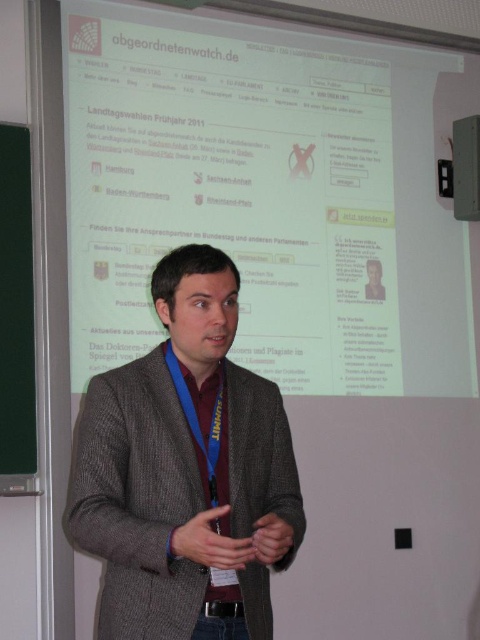
Which is more to the right, white glossy projection screen at upper center or gray woolen sweater at center?

Positioned to the right is white glossy projection screen at upper center.

Between white glossy projection screen at upper center and gray woolen sweater at center, which one has more height?

white glossy projection screen at upper center

Who is more forward, (319,310) or (184,476)?

Point (184,476) is more forward.

Identify the location of white glossy projection screen at upper center. The width and height of the screenshot is (480, 640). (x=264, y=196).

Does white glossy projection screen at upper center have a greater height compared to green matte/blackboard at left?

Indeed, white glossy projection screen at upper center has a greater height compared to green matte/blackboard at left.

Is the position of white glossy projection screen at upper center less distant than that of green matte/blackboard at left?

No.

In order to click on white glossy projection screen at upper center in this screenshot , I will do (264, 196).

Who is shorter, gray woolen sweater at center or green matte/blackboard at left?

With less height is gray woolen sweater at center.

Consider the image. Measure the distance between gray woolen sweater at center and green matte/blackboard at left.

gray woolen sweater at center is 1.22 meters away from green matte/blackboard at left.

Does point (141, 552) come closer to viewer compared to point (19, 237)?

Yes.

Locate an element on the screen. The width and height of the screenshot is (480, 640). gray woolen sweater at center is located at coordinates [184, 472].